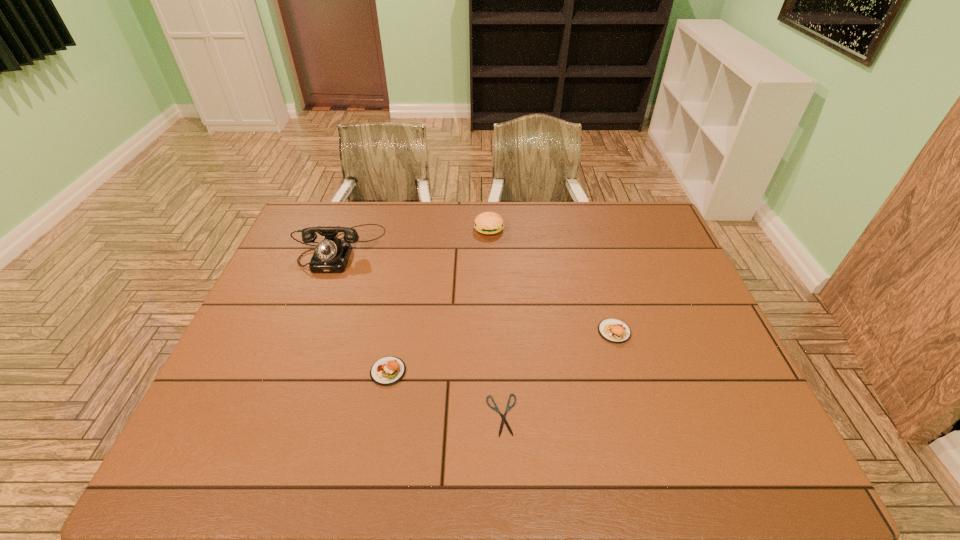
Identify the location of telephone. coord(331,255).

In order to click on the leftmost object in this screenshot , I will do `click(331, 255)`.

The image size is (960, 540). Find the location of `the fourth shortest object`. the fourth shortest object is located at coordinates (488, 223).

Image resolution: width=960 pixels, height=540 pixels. Find the location of `the tallest patty (food)`. the tallest patty (food) is located at coordinates (x=488, y=223).

Where is `the third tallest object`? This screenshot has width=960, height=540. the third tallest object is located at coordinates (613, 330).

You are a GUI agent. You are given a task and a screenshot of the screen. Output one action in this format:
    pyautogui.click(x=<x>, y=<y>)
    Task: Click on the rightmost patty (food)
    
    Given the screenshot: What is the action you would take?
    pyautogui.click(x=613, y=330)

Where is `the shortest patty (food)`? Image resolution: width=960 pixels, height=540 pixels. the shortest patty (food) is located at coordinates (389, 370).

Locate an element on the screen. This screenshot has width=960, height=540. the second object from left to right is located at coordinates (389, 370).

Locate an element on the screen. Image resolution: width=960 pixels, height=540 pixels. the shortest object is located at coordinates (508, 407).

Identify the location of shears. (508, 407).